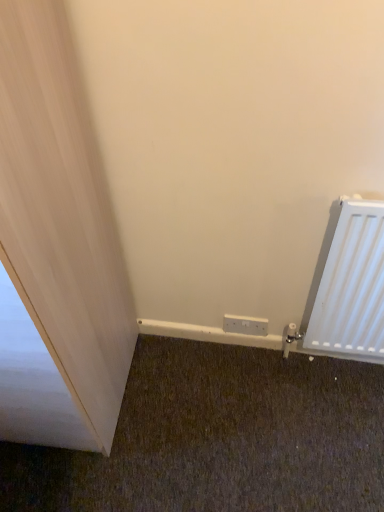
Question: Does white plastic electric outlet at lower center appear on the left side of white matte radiator at right?

Choices:
 (A) yes
 (B) no

Answer: (A)

Question: From a real-world perspective, is white plastic electric outlet at lower center located beneath white matte radiator at right?

Choices:
 (A) no
 (B) yes

Answer: (B)

Question: Can you confirm if white plastic electric outlet at lower center is positioned to the right of white matte radiator at right?

Choices:
 (A) no
 (B) yes

Answer: (A)

Question: Is white plastic electric outlet at lower center touching white matte radiator at right?

Choices:
 (A) no
 (B) yes

Answer: (A)

Question: Could you tell me if white plastic electric outlet at lower center is turned towards white matte radiator at right?

Choices:
 (A) no
 (B) yes

Answer: (A)

Question: From the image's perspective, is white plastic electric outlet at lower center above white matte radiator at right?

Choices:
 (A) no
 (B) yes

Answer: (A)

Question: Is white matte radiator at right further to camera compared to white plastic electric outlet at lower center?

Choices:
 (A) yes
 (B) no

Answer: (B)

Question: Is white matte radiator at right positioned in front of white plastic electric outlet at lower center?

Choices:
 (A) no
 (B) yes

Answer: (B)

Question: Is white plastic electric outlet at lower center surrounded by white matte radiator at right?

Choices:
 (A) no
 (B) yes

Answer: (A)

Question: Considering the relative sizes of white matte radiator at right and white plastic electric outlet at lower center in the image provided, is white matte radiator at right bigger than white plastic electric outlet at lower center?

Choices:
 (A) no
 (B) yes

Answer: (B)

Question: Is white matte radiator at right not inside white plastic electric outlet at lower center?

Choices:
 (A) yes
 (B) no

Answer: (A)

Question: From a real-world perspective, does white matte radiator at right sit lower than white plastic electric outlet at lower center?

Choices:
 (A) yes
 (B) no

Answer: (B)

Question: Is white matte radiator at right taller or shorter than white plastic electric outlet at lower center?

Choices:
 (A) tall
 (B) short

Answer: (A)